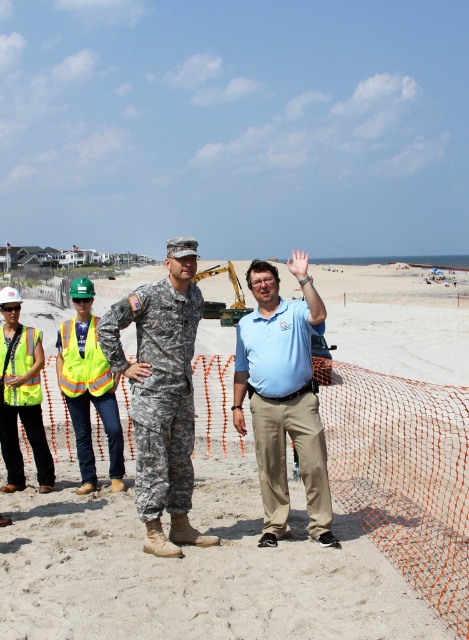
You are a safety inspector and need to ensure that the neon yellow reflective vest at left and the reflective yellow vest at left are spaced at least 30 inches apart for safety regulations. Based on the image, are they compliant?

The neon yellow reflective vest at left and the reflective yellow vest at left are 28.12 inches apart, which is less than the required 30 inches. Therefore, they are not compliant with safety regulations.

You are a safety inspector on the beach and need to identify the smaller safety vest among the neon yellow reflective vest at left and the reflective yellow vest at left. Which one should you choose?

The neon yellow reflective vest at left is smaller in size compared to the reflective yellow vest at left, so you should choose the neon yellow reflective vest at left.

You are a safety inspector standing at the camera position. You need to reach the neon yellow reflective vest at left to check its placement. Can you walk directly to it without needing to move any obstacles?

The neon yellow reflective vest at left is 6.01 meters away from your position, so yes, you can walk directly to it since there are no mentioned obstacles in the scene description.